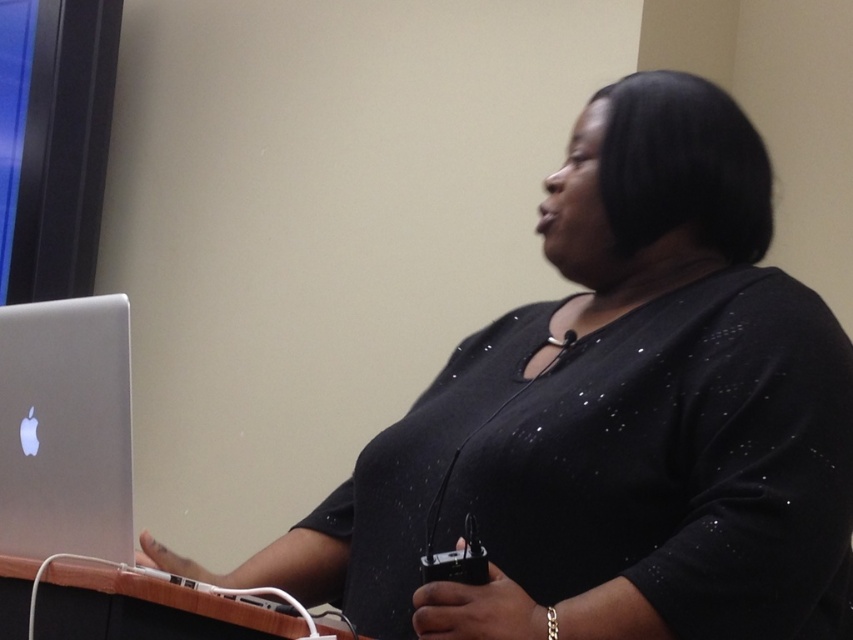
You are an event organizer setting up for a presentation. You need to place a new projector remote that is 10 cm wide on the podium. The silver metallic laptop at left is currently occupying space. Can the remote be placed next to the laptop without moving it?

The silver metallic laptop at left is located at point (65, 428). Since the exact dimensions of the podium and the space around the laptop aren

You are organizing a presentation and need to place your laptop on a surface. Based on the scene, can you confirm if the silver metallic laptop at left is placed on the wooden table at lower left?

The silver metallic laptop at left is above wooden table at lower left, which means it is placed on the wooden table at lower left.